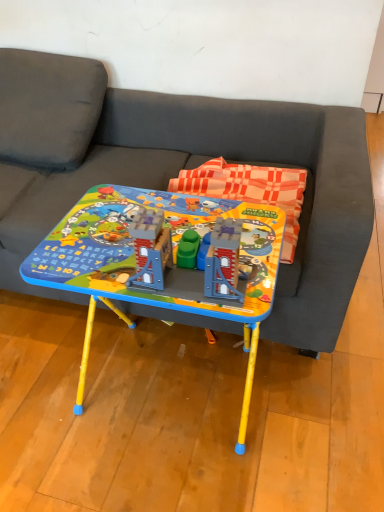
Identify the location of vacant space underneath matte plastic table at center (from a real-world perspective). (161, 382).